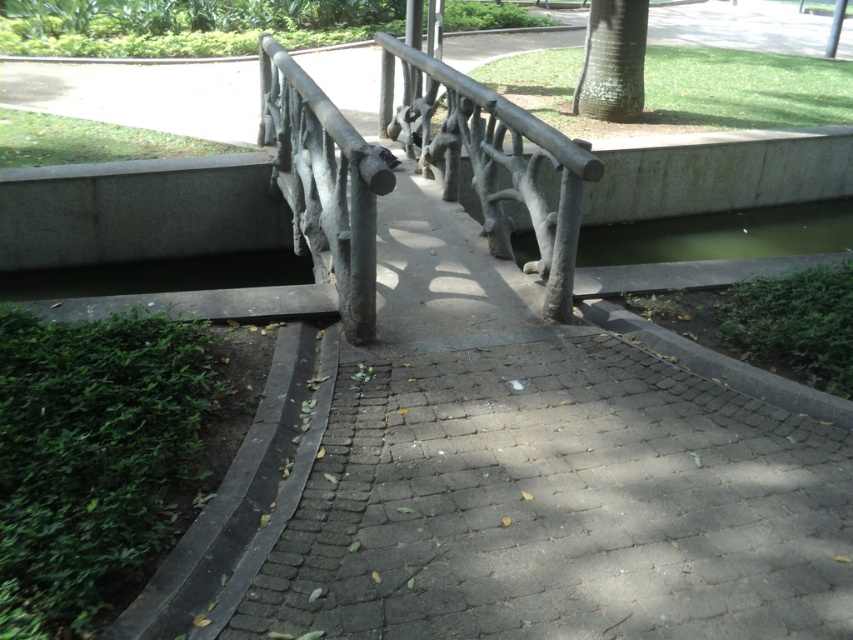
Question: Which object is farther from the camera taking this photo?

Choices:
 (A) rustic wood rail at center
 (B) white textured bark at upper right

Answer: (B)

Question: Among these objects, which one is nearest to the camera?

Choices:
 (A) rustic wood rail at center
 (B) white textured bark at upper right

Answer: (A)

Question: Is rustic wood rail at center in front of white textured bark at upper right?

Choices:
 (A) yes
 (B) no

Answer: (A)

Question: Can you confirm if rustic wood rail at center is wider than white textured bark at upper right?

Choices:
 (A) yes
 (B) no

Answer: (A)

Question: Does rustic wood rail at center appear over white textured bark at upper right?

Choices:
 (A) no
 (B) yes

Answer: (A)